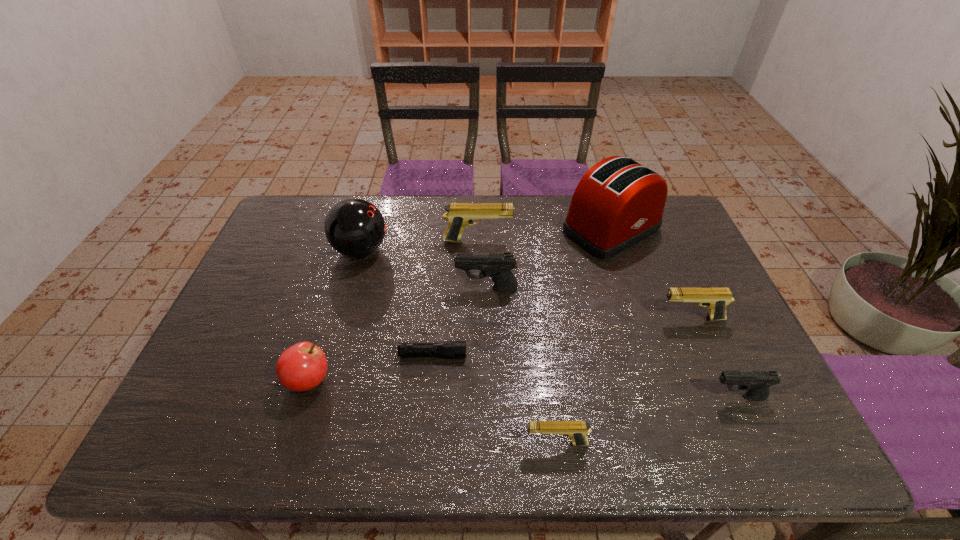
In order to click on apple in this screenshot , I will do pyautogui.click(x=303, y=366).

Identify the location of the fourth farthest pistol. This screenshot has height=540, width=960. (757, 383).

What are the coordinates of `the right black pistol` in the screenshot? It's located at (757, 383).

Find the location of a particular element. The height and width of the screenshot is (540, 960). the second shortest object is located at coordinates (575, 430).

The image size is (960, 540). Find the location of `the shortest pistol`. the shortest pistol is located at coordinates (575, 430).

Locate an element on the screen. The height and width of the screenshot is (540, 960). the shortest object is located at coordinates (451, 349).

The width and height of the screenshot is (960, 540). Find the location of `flashlight`. flashlight is located at coordinates (451, 349).

This screenshot has width=960, height=540. I want to click on free space located on the left of the red toaster, so click(538, 230).

The image size is (960, 540). Identify the location of vacant space located on the surface of the bowling ball near the finger holes. (470, 250).

Locate an element on the screen. vacant space located 0.390m at the barrel of the farthest tan pistol is located at coordinates (632, 240).